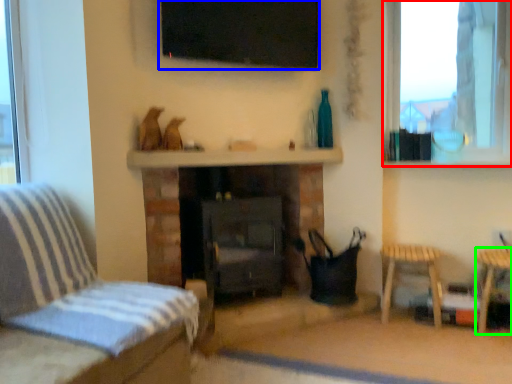
Question: Estimate the real-world distances between objects in this image. Which object is closer to window (highlighted by a red box), window screen (highlighted by a blue box) or side table (highlighted by a green box)?

Choices:
 (A) window screen
 (B) side table

Answer: (A)